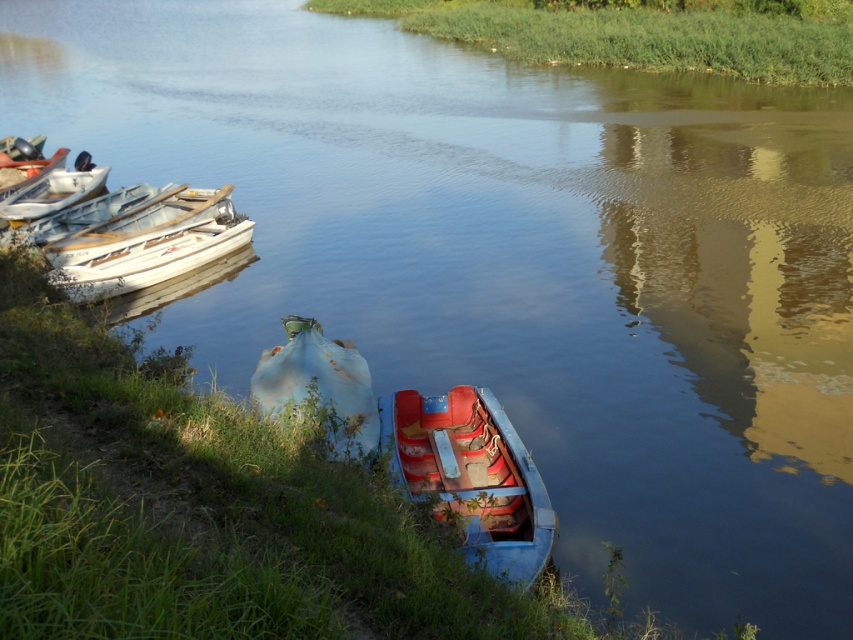
Does rusty blue boat at center appear on the right side of white matte boat at left?

Correct, you'll find rusty blue boat at center to the right of white matte boat at left.

Is rusty blue boat at center further to the viewer compared to white matte boat at left?

No, rusty blue boat at center is in front of white matte boat at left.

Locate an element on the screen. rusty blue boat at center is located at coordinates click(473, 476).

Does rusty blue boat at center appear over blue faded fabric boat at center?

Actually, rusty blue boat at center is below blue faded fabric boat at center.

Does point (485, 531) lie in front of point (312, 392)?

Yes.

Is point (502, 410) farther from viewer compared to point (279, 410)?

That is True.

I want to click on rusty blue boat at center, so click(x=473, y=476).

Does rusty blue boat at center have a greater width compared to white plastic boats at left?

Indeed, rusty blue boat at center has a greater width compared to white plastic boats at left.

Does rusty blue boat at center have a larger size compared to white plastic boats at left?

Yes.

Describe the element at coordinates (473, 476) in the screenshot. Image resolution: width=853 pixels, height=640 pixels. I see `rusty blue boat at center` at that location.

At what (x,y) coordinates should I click in order to perform the action: click on rusty blue boat at center. Please return your answer as a coordinate pair (x, y). The image size is (853, 640). Looking at the image, I should click on (473, 476).